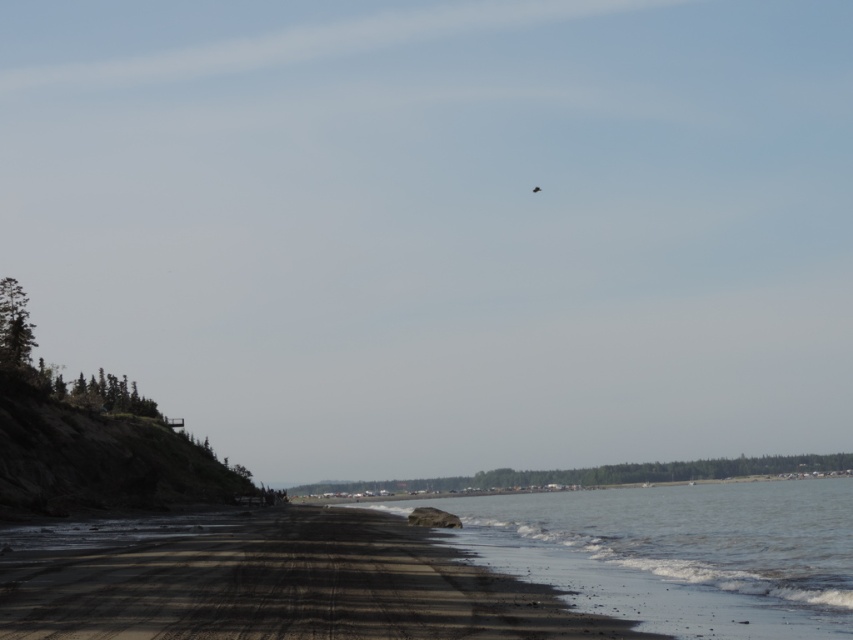
Question: Does dark sand beach at lower left have a larger size compared to black sand at lower right?

Choices:
 (A) no
 (B) yes

Answer: (A)

Question: Which point is closer to the camera?

Choices:
 (A) dark sand beach at lower left
 (B) black sand at lower right

Answer: (A)

Question: Which point is closer to the camera taking this photo?

Choices:
 (A) (254, 586)
 (B) (769, 506)

Answer: (A)

Question: Considering the relative positions of dark sand beach at lower left and black sand at lower right in the image provided, where is dark sand beach at lower left located with respect to black sand at lower right?

Choices:
 (A) left
 (B) right

Answer: (A)

Question: Does dark sand beach at lower left appear over black sand at lower right?

Choices:
 (A) yes
 (B) no

Answer: (A)